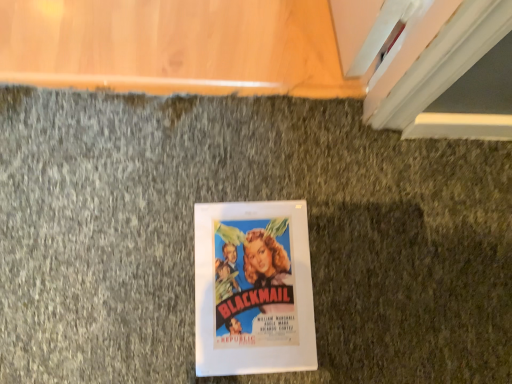
Image resolution: width=512 pixels, height=384 pixels. In order to click on vacant region to the left of matte paper poster at center in this screenshot , I will do `click(133, 258)`.